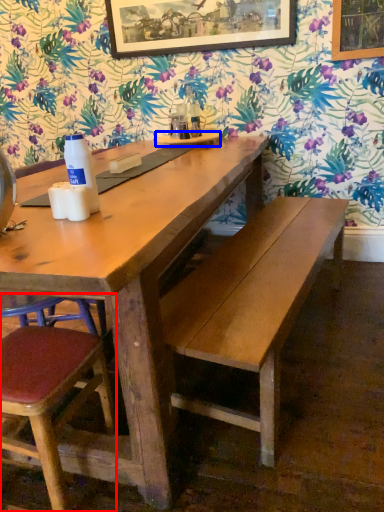
Question: Which of the following is the closest to the observer, chair (highlighted by a red box) or plate (highlighted by a blue box)?

Choices:
 (A) chair
 (B) plate

Answer: (A)